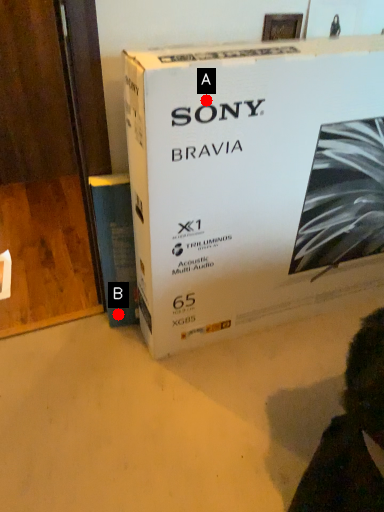
Question: Two points are circled on the image, labeled by A and B beside each circle. Which point is closer to the camera taking this photo?

Choices:
 (A) A is closer
 (B) B is closer

Answer: (A)